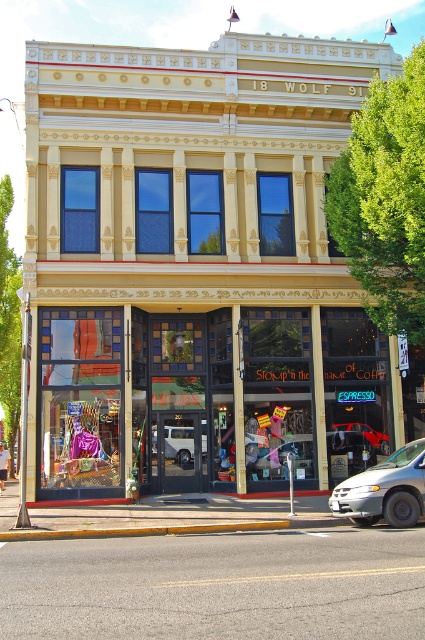
Question: Which of the following is the farthest from the observer?

Choices:
 (A) (263, 369)
 (B) (209, 344)
 (C) (367, 500)

Answer: (B)

Question: Which is nearer to the white matte van at lower right?

Choices:
 (A) translucent glass window at center
 (B) white matte van at center

Answer: (A)

Question: Which of the following is the farthest from the observer?

Choices:
 (A) (360, 480)
 (B) (249, 257)
 (C) (323, 397)
 (D) (190, 438)

Answer: (D)

Question: Can you confirm if matte glass storefront at center is positioned below translucent glass window at center?

Choices:
 (A) yes
 (B) no

Answer: (B)

Question: Is matte glass storefront at center closer to camera compared to white matte van at lower right?

Choices:
 (A) no
 (B) yes

Answer: (A)

Question: Observing the image, what is the correct spatial positioning of matte glass storefront at center in reference to white matte van at lower right?

Choices:
 (A) left
 (B) right

Answer: (A)